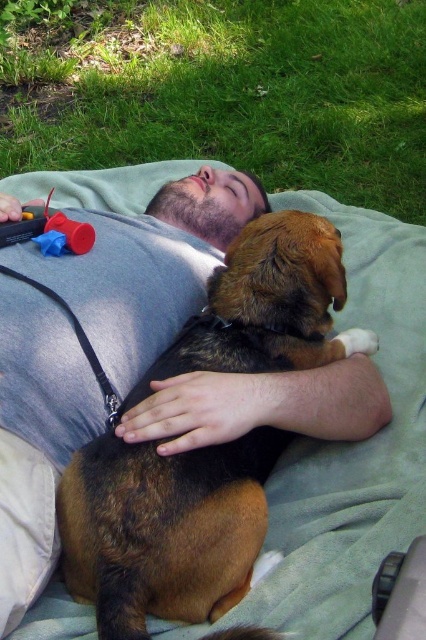
Looking at this image, is brown fur dog at center positioned before rubberized plastic toy at upper left?

Yes, it is.

What do you see at coordinates (164, 529) in the screenshot? I see `brown fur dog at center` at bounding box center [164, 529].

The image size is (426, 640). What are the coordinates of `brown fur dog at center` in the screenshot? It's located at (164, 529).

Based on the photo, can you confirm if green grass at upper center is taller than brown fur dog at center?

Yes, green grass at upper center is taller than brown fur dog at center.

The height and width of the screenshot is (640, 426). Describe the element at coordinates (227, 92) in the screenshot. I see `green grass at upper center` at that location.

The height and width of the screenshot is (640, 426). Identify the location of green grass at upper center. (227, 92).

Is point (97, 122) closer to viewer compared to point (77, 240)?

No, (97, 122) is further to viewer.

Is point (377, 54) positioned after point (80, 228)?

Yes, it is behind point (80, 228).

This screenshot has height=640, width=426. In order to click on green grass at upper center in this screenshot , I will do `click(227, 92)`.